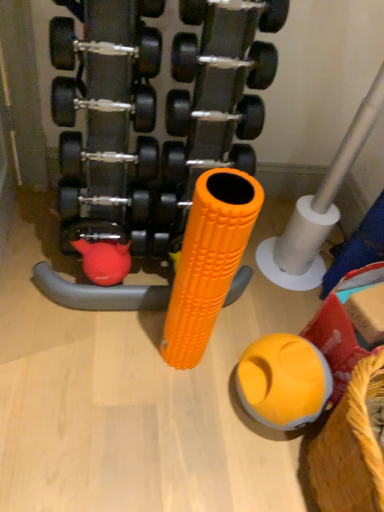
Identify the location of free space in front of black rubber dumbbell at center. (118, 393).